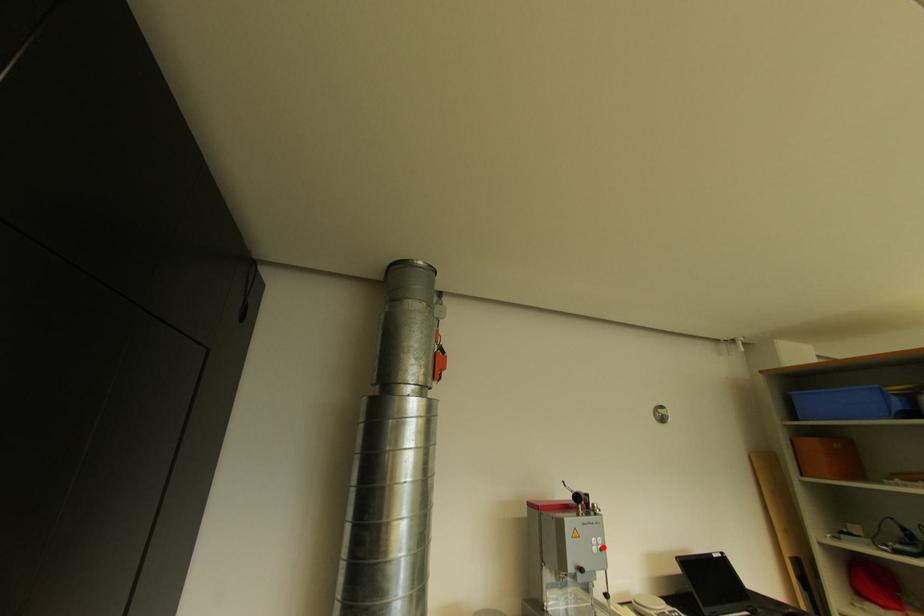
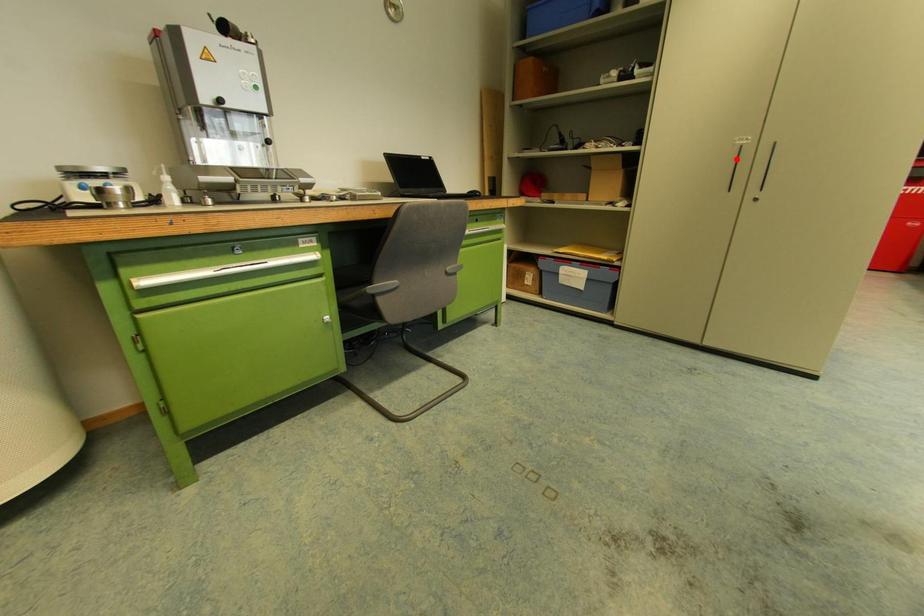
I am providing you with two images of the same scene from different viewpoints. A red point is marked on the first image and another point is marked on the second image. Are the points marked in image1 and image2 representing the same 3D position?

No